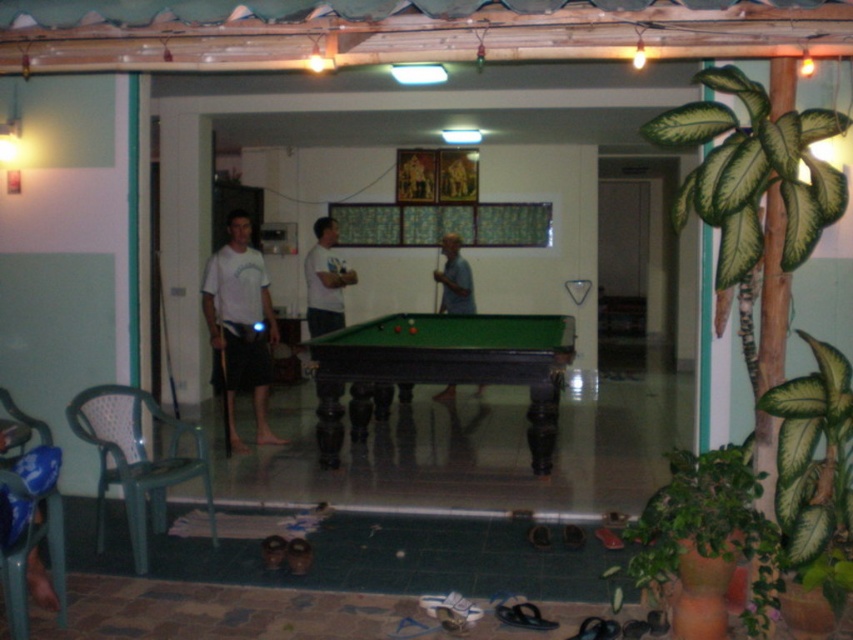
Question: Estimate the real-world distances between objects in this image. Which object is farther from the white matte shorts at left?

Choices:
 (A) green matte plant at lower right
 (B) matte white shirt at center
 (C) white matte shirt at center
 (D) green felt pool table at center

Answer: (A)

Question: Which is farther from the matte white shirt at center?

Choices:
 (A) white matte shorts at left
 (B) green felt pool table at center
 (C) white matte shirt at center

Answer: (A)

Question: Can you confirm if green matte plant at lower right is positioned to the left of white matte shirt at center?

Choices:
 (A) yes
 (B) no

Answer: (B)

Question: Based on their relative distances, which object is nearer to the white matte shirt at center?

Choices:
 (A) green matte plant at lower right
 (B) matte white shirt at center
 (C) white matte shorts at left
 (D) green felt pool table at center

Answer: (B)

Question: Does green felt pool table at center appear on the right side of green matte plant at lower right?

Choices:
 (A) yes
 (B) no

Answer: (B)

Question: Is white matte shirt at center to the right of matte white shirt at center from the viewer's perspective?

Choices:
 (A) no
 (B) yes

Answer: (A)